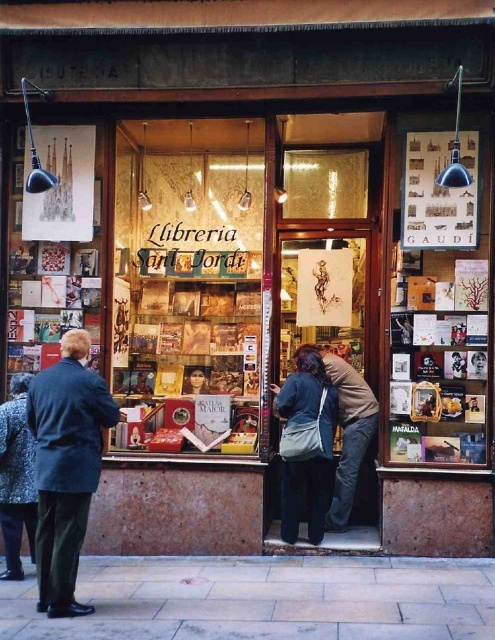
Question: Where is matte glass display case at center located in relation to dark blue coat at left in the image?

Choices:
 (A) above
 (B) below

Answer: (A)

Question: Which object is closer to the camera taking this photo?

Choices:
 (A) matte glass display case at center
 (B) dark blue coat at left
 (C) speckled wool coat at lower left

Answer: (B)

Question: Does dark blue fabric bag at center have a larger size compared to speckled wool coat at lower left?

Choices:
 (A) yes
 (B) no

Answer: (A)

Question: Which point is closer to the camera?

Choices:
 (A) (284, 536)
 (B) (168, 289)
 (C) (58, 547)

Answer: (C)

Question: Considering the relative positions of matte glass display case at center and speckled wool coat at lower left in the image provided, where is matte glass display case at center located with respect to speckled wool coat at lower left?

Choices:
 (A) left
 (B) right

Answer: (B)

Question: Which point is closer to the camera taking this photo?

Choices:
 (A) (18, 561)
 (B) (196, 288)

Answer: (A)